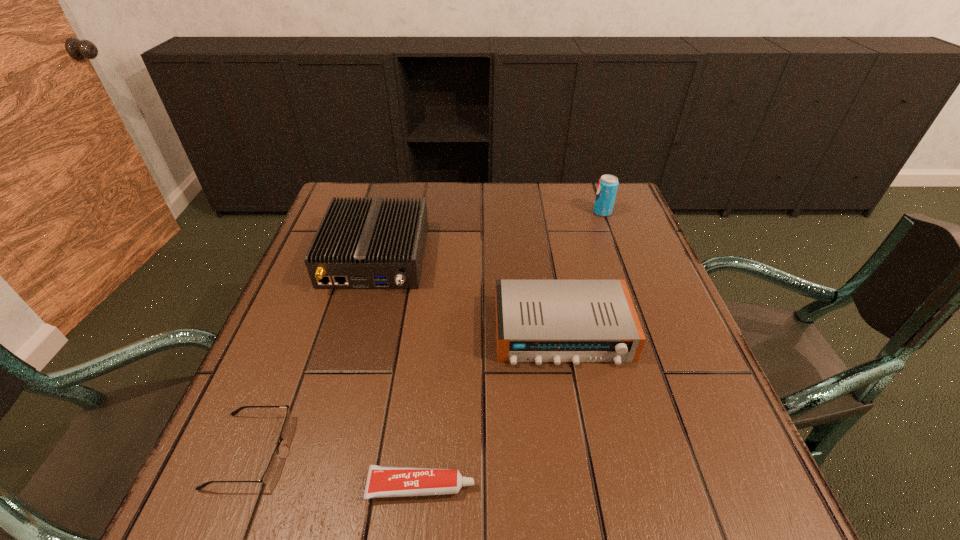
Locate an element on the screen. object present at the far left corner is located at coordinates (360, 244).

Locate an element on the screen. The height and width of the screenshot is (540, 960). object present at the near left corner is located at coordinates (273, 464).

The width and height of the screenshot is (960, 540). Identify the location of object at the far right corner. (607, 188).

You are a GUI agent. You are given a task and a screenshot of the screen. Output one action in this format:
    pyautogui.click(x=<x>, y=<y>)
    Task: Click on the free space at the far edge of the desktop
    The width and height of the screenshot is (960, 540).
    Given the screenshot: What is the action you would take?
    pyautogui.click(x=488, y=223)

Identify the location of free space at the near edge of the desktop. The image size is (960, 540). (385, 523).

This screenshot has width=960, height=540. In the image, there is a desktop. Identify the location of vacant space at the right edge. 703,394.

This screenshot has height=540, width=960. I want to click on free space at the far left corner, so click(x=370, y=190).

This screenshot has height=540, width=960. Find the location of `vacant space at the near left corner of the desktop`. vacant space at the near left corner of the desktop is located at coordinates (235, 492).

The image size is (960, 540). In order to click on vacant area at the far right corner in this screenshot , I will do `click(623, 194)`.

At what (x,y) coordinates should I click in order to perform the action: click on free area in between the toothpaste and the second farthest object. Please return your answer as a coordinate pair (x, y). Looking at the image, I should click on (398, 371).